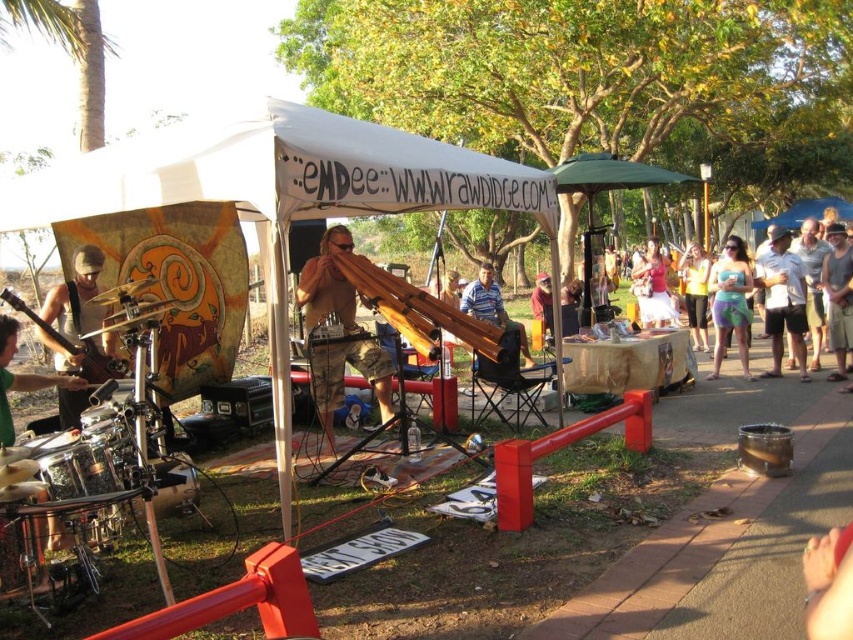
Which is more to the left, matte brown guitar at left or white cotton shirt at right?

matte brown guitar at left

Does matte brown guitar at left have a lesser height compared to white cotton shirt at right?

Indeed, matte brown guitar at left has a lesser height compared to white cotton shirt at right.

This screenshot has width=853, height=640. Describe the element at coordinates (77, 298) in the screenshot. I see `matte brown guitar at left` at that location.

You are a GUI agent. You are given a task and a screenshot of the screen. Output one action in this format:
    pyautogui.click(x=<x>, y=<y>)
    Task: Click on the matte brown guitar at left
    The image size is (853, 640).
    Given the screenshot: What is the action you would take?
    pyautogui.click(x=77, y=298)

Is blue denim shorts at center below striped polo shirt at center?

Correct, blue denim shorts at center is located below striped polo shirt at center.

Is blue denim shorts at center bigger than striped polo shirt at center?

No, blue denim shorts at center is not bigger than striped polo shirt at center.

Locate an element on the screen. blue denim shorts at center is located at coordinates (695, 292).

What are the coordinates of `blue denim shorts at center` in the screenshot? It's located at click(x=695, y=292).

Can you confirm if white fabric tent at center is positioned to the right of wooden flute at center?

Yes, white fabric tent at center is to the right of wooden flute at center.

Does white fabric tent at center have a lesser height compared to wooden flute at center?

Correct, white fabric tent at center is not as tall as wooden flute at center.

The height and width of the screenshot is (640, 853). What do you see at coordinates (277, 193) in the screenshot? I see `white fabric tent at center` at bounding box center [277, 193].

In order to click on white fabric tent at center in this screenshot , I will do `click(277, 193)`.